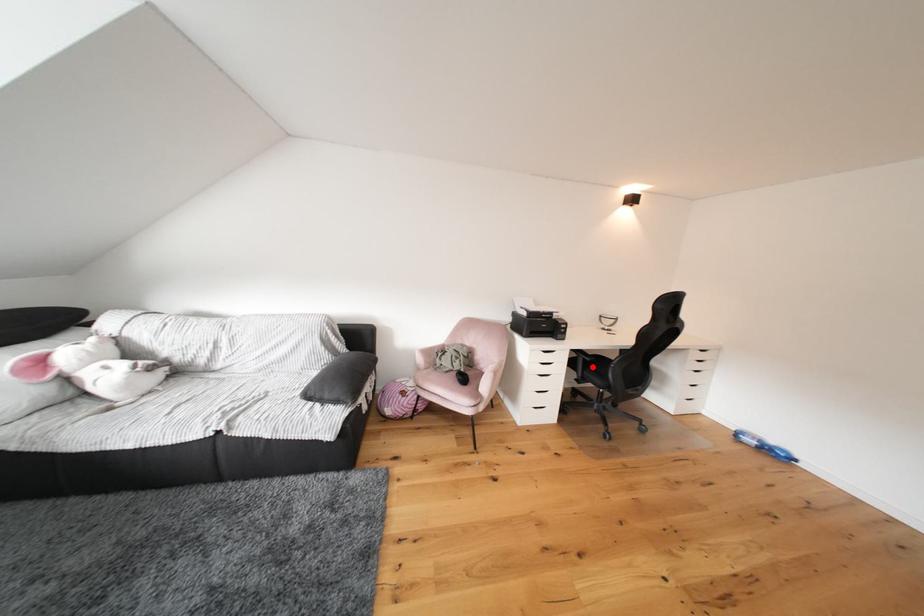
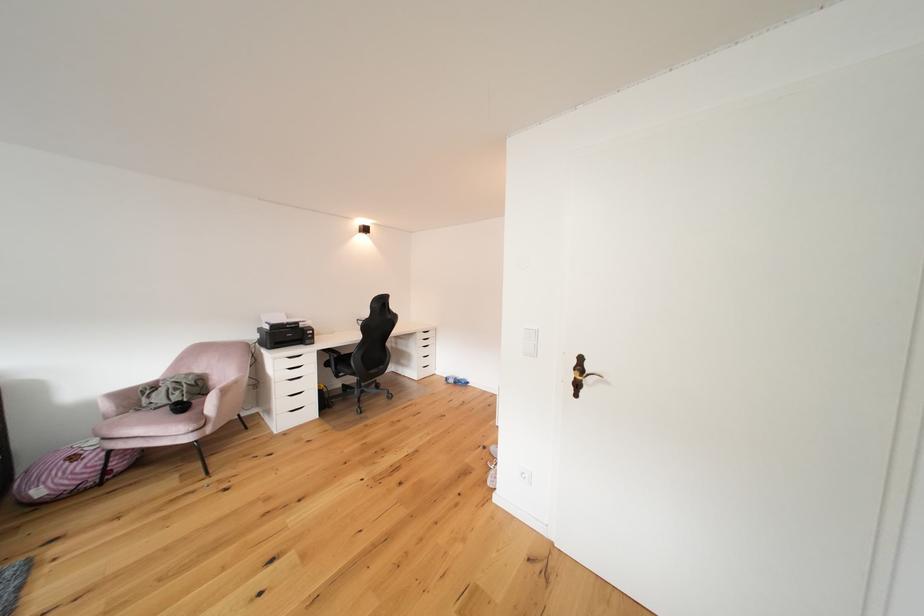
Question: I am providing you with two images of the same scene from different viewpoints. In image1, a red point is highlighted. Considering the same 3D point in image2, which of the following is correct?

Choices:
 (A) It is closer
 (B) It is farther

Answer: (A)